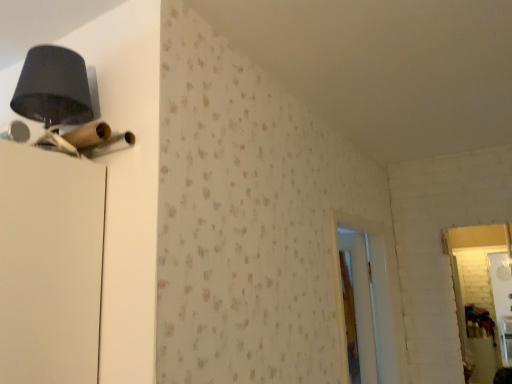
Question: Is matte black lampshade at upper left inside or outside of white wooden screen door at center?

Choices:
 (A) inside
 (B) outside

Answer: (B)

Question: From a real-world perspective, is matte black lampshade at upper left positioned above or below white wooden screen door at center?

Choices:
 (A) above
 (B) below

Answer: (A)

Question: Visually, is matte black lampshade at upper left positioned to the left or to the right of white wooden screen door at center?

Choices:
 (A) left
 (B) right

Answer: (A)

Question: Is white wooden screen door at center in front of or behind matte black lampshade at upper left in the image?

Choices:
 (A) front
 (B) behind

Answer: (B)

Question: Is white wooden screen door at center situated inside matte black lampshade at upper left or outside?

Choices:
 (A) inside
 (B) outside

Answer: (B)

Question: Is point (387, 380) closer or farther from the camera than point (61, 82)?

Choices:
 (A) farther
 (B) closer

Answer: (A)

Question: Considering the positions of white wooden screen door at center and matte black lampshade at upper left in the image, is white wooden screen door at center wider or thinner than matte black lampshade at upper left?

Choices:
 (A) thin
 (B) wide

Answer: (A)